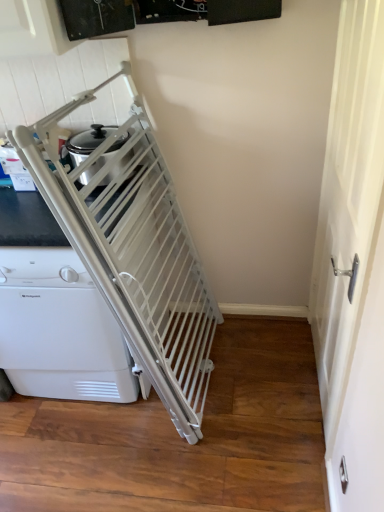
Identify the location of vacant area that is in front of white plastic gate at left. (97, 451).